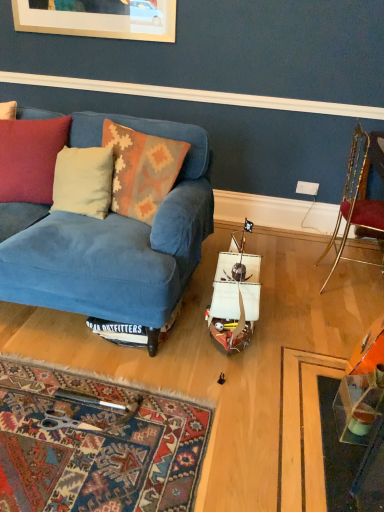
The width and height of the screenshot is (384, 512). What are the coordinates of `gold metallic chair at right` in the screenshot? It's located at (359, 192).

I want to click on pillow located on the right of beige fabric pillow at left, acting as the 1th pillow starting from the left, so click(x=141, y=169).

Is beige fabric pillow at left, acting as the 1th pillow starting from the left, facing away from knitted wool pillow at center, which is counted as the 2th pillow, starting from the left?

No, beige fabric pillow at left, acting as the 1th pillow starting from the left, is not facing the opposite direction of knitted wool pillow at center, which is counted as the 2th pillow, starting from the left.

Is beige fabric pillow at left, acting as the 1th pillow starting from the left, next to knitted wool pillow at center, acting as the 1th pillow starting from the right?

There is a gap between beige fabric pillow at left, acting as the 1th pillow starting from the left, and knitted wool pillow at center, acting as the 1th pillow starting from the right.

Is blue velvet couch at center turned away from gold metallic chair at right?

No.

Which is nearer, (145,226) or (359,173)?

The point (145,226) is more forward.

Considering the sizes of blue velvet couch at center and gold metallic chair at right in the image, is blue velvet couch at center taller or shorter than gold metallic chair at right?

Clearly, blue velvet couch at center is shorter compared to gold metallic chair at right.

Is blue velvet couch at center smaller than gold metallic chair at right?

No, blue velvet couch at center is not smaller than gold metallic chair at right.

Is gold metallic chair at right bigger or smaller than transparent plastic table at lower right?

In the image, gold metallic chair at right appears to be larger than transparent plastic table at lower right.

Can you confirm if gold metallic chair at right is positioned to the left of transparent plastic table at lower right?

No.

Between gold metallic chair at right and transparent plastic table at lower right, which one is positioned in front?

transparent plastic table at lower right is in front.

Does point (344, 231) appear closer or farther from the camera than point (366, 343)?

Point (344, 231) is farther from the camera than point (366, 343).

Is transparent plastic table at lower right placed right next to blue velvet couch at center?

transparent plastic table at lower right and blue velvet couch at center are clearly separated.

Could blue velvet couch at center be considered to be inside transparent plastic table at lower right?

No.

From a real-world perspective, which object rests below the other?

transparent plastic table at lower right, from a real-world perspective.

Looking at this image, from the image's perspective, which object appears higher, transparent plastic table at lower right or blue velvet couch at center?

blue velvet couch at center appears higher in the image.

Does gold metallic chair at right have a larger size compared to white plastic power outlet at center?

Correct, gold metallic chair at right is larger in size than white plastic power outlet at center.

Does gold metallic chair at right touch white plastic power outlet at center?

gold metallic chair at right and white plastic power outlet at center are clearly separated.

From the image's perspective, between gold metallic chair at right and white plastic power outlet at center, which one is located above?

white plastic power outlet at center appears higher in the image.

Which object is thinner, gold metallic chair at right or white plastic power outlet at center?

With smaller width is white plastic power outlet at center.

From the image's perspective, is transparent plastic table at lower right located above or below beige fabric pillow at left, acting as the 1th pillow starting from the left?

From the image's perspective, transparent plastic table at lower right appears below beige fabric pillow at left, acting as the 1th pillow starting from the left.

This screenshot has height=512, width=384. In order to click on pillow that is the 2nd object to the left of the transparent plastic table at lower right, starting at the anchor in this screenshot , I will do `click(83, 181)`.

Can you confirm if transparent plastic table at lower right is thinner than beige fabric pillow at left, which ranks as the 2th pillow in right-to-left order?

Correct, the width of transparent plastic table at lower right is less than that of beige fabric pillow at left, which ranks as the 2th pillow in right-to-left order.

Would you say transparent plastic table at lower right is outside beige fabric pillow at left, acting as the 1th pillow starting from the left?

transparent plastic table at lower right is positioned outside beige fabric pillow at left, acting as the 1th pillow starting from the left.

Is beige fabric pillow at left, acting as the 1th pillow starting from the left, turned away from transparent plastic table at lower right?

No, beige fabric pillow at left, acting as the 1th pillow starting from the left, is not facing the opposite direction of transparent plastic table at lower right.

From the picture: What's the angular difference between beige fabric pillow at left, which ranks as the 2th pillow in right-to-left order, and transparent plastic table at lower right's facing directions?

beige fabric pillow at left, which ranks as the 2th pillow in right-to-left order, and transparent plastic table at lower right are facing 77.4 degrees away from each other.

From the image's perspective, is beige fabric pillow at left, acting as the 1th pillow starting from the left, below transparent plastic table at lower right?

No.

Consider the image. Who is taller, beige fabric pillow at left, which ranks as the 2th pillow in right-to-left order, or transparent plastic table at lower right?

beige fabric pillow at left, which ranks as the 2th pillow in right-to-left order.

Identify the location of pillow lying on the right of beige fabric pillow at left, which ranks as the 2th pillow in right-to-left order. The width and height of the screenshot is (384, 512). (141, 169).

Where is `chair that is above the blue velvet couch at center (from the image's perspective)`? This screenshot has width=384, height=512. chair that is above the blue velvet couch at center (from the image's perspective) is located at coordinates (359, 192).

When comparing their distances from white plastic power outlet at center, does knitted wool pillow at center, acting as the 1th pillow starting from the right, or beige fabric pillow at left, acting as the 1th pillow starting from the left, seem further?

beige fabric pillow at left, acting as the 1th pillow starting from the left, is further to white plastic power outlet at center.

When comparing their distances from beige fabric pillow at left, which ranks as the 2th pillow in right-to-left order, does velvet cushion at left or white plastic power outlet at center seem further?

white plastic power outlet at center.

Based on their spatial positions, is blue velvet couch at center or transparent plastic table at lower right closer to gold metallic chair at right?

Based on the image, transparent plastic table at lower right appears to be nearer to gold metallic chair at right.

Considering their positions, is velvet cushion at left positioned further to transparent plastic table at lower right than white plastic power outlet at center?

Based on the image, velvet cushion at left appears to be further to transparent plastic table at lower right.

Which object lies nearer to the anchor point transparent plastic table at lower right, velvet cushion at left or beige fabric pillow at left, acting as the 1th pillow starting from the left?

beige fabric pillow at left, acting as the 1th pillow starting from the left, is positioned closer to the anchor transparent plastic table at lower right.

Looking at the image, which one is located further to blue velvet couch at center, velvet cushion at left or beige fabric pillow at left, which ranks as the 2th pillow in right-to-left order?

velvet cushion at left lies further to blue velvet couch at center than the other object.

Estimate the real-world distances between objects in this image. Which object is closer to gold metallic chair at right, knitted wool pillow at center, acting as the 1th pillow starting from the right, or beige fabric pillow at left, which ranks as the 2th pillow in right-to-left order?

knitted wool pillow at center, acting as the 1th pillow starting from the right, is positioned closer to the anchor gold metallic chair at right.

Which object lies nearer to the anchor point blue velvet couch at center, transparent plastic table at lower right or gold metallic chair at right?

Among the two, transparent plastic table at lower right is located nearer to blue velvet couch at center.

Where is `studio couch between velvet cushion at left and gold metallic chair at right from left to right`? The width and height of the screenshot is (384, 512). studio couch between velvet cushion at left and gold metallic chair at right from left to right is located at coordinates (111, 241).

Image resolution: width=384 pixels, height=512 pixels. Find the location of `chair between transparent plastic table at lower right and white plastic power outlet at center in the front-back direction`. chair between transparent plastic table at lower right and white plastic power outlet at center in the front-back direction is located at coordinates (359, 192).

Image resolution: width=384 pixels, height=512 pixels. I want to click on pillow positioned between knitted wool pillow at center, acting as the 1th pillow starting from the right, and white plastic power outlet at center from near to far, so click(x=83, y=181).

You are a GUI agent. You are given a task and a screenshot of the screen. Output one action in this format:
    pyautogui.click(x=<x>, y=<y>)
    Task: Click on the table between knitted wool pillow at center, acting as the 1th pillow starting from the right, and gold metallic chair at right
    The image size is (384, 512).
    Given the screenshot: What is the action you would take?
    pyautogui.click(x=362, y=364)